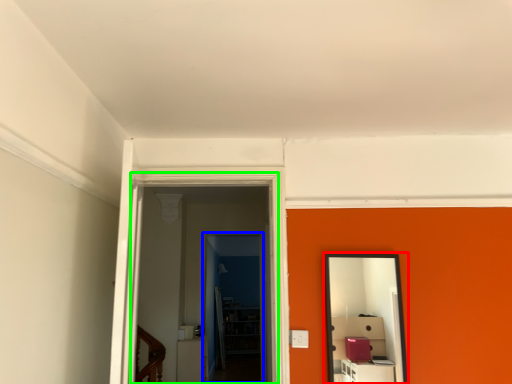
Question: Which object is the farthest from mirror (highlighted by a red box)? Choose among these: glass door (highlighted by a blue box) or glass door (highlighted by a green box).

Choices:
 (A) glass door
 (B) glass door

Answer: (A)